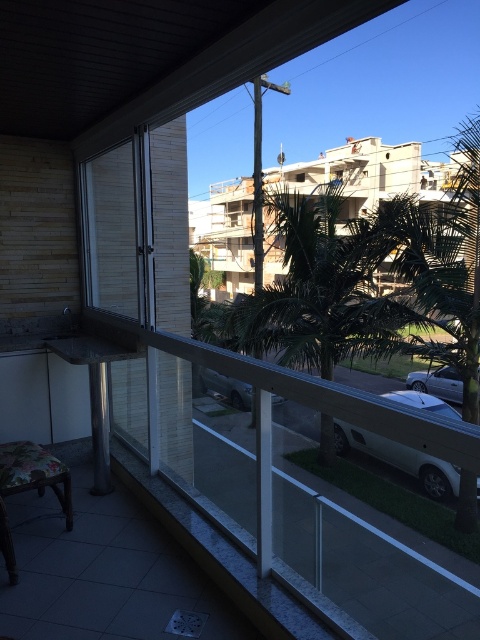
You are standing on the balcony and looking out. You see a white matte car at lower right and a silver metallic car at center. Which car is positioned more to the right side of your view?

The white matte car at lower right is positioned more to the right side of your view because it is to the right of the silver metallic car at center.

You are a delivery person trying to park your van in the parking lot visible from the balcony. You notice the white matte car at lower right and the silver metallic car at center. Which car takes up more space in the parking spot?

The white matte car at lower right takes up more space in the parking spot because it has a larger size compared to the silver metallic car at center.